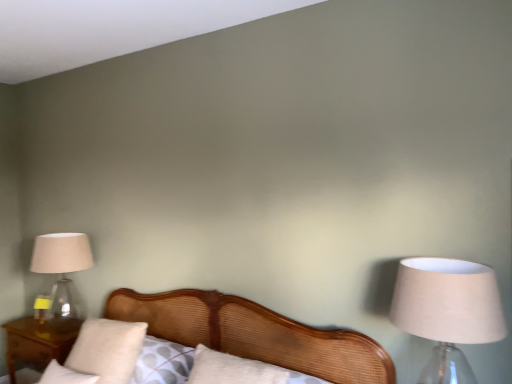
Question: From the image's perspective, is wooden bed at center above or below beige fabric lampshade at right, positioned as the second lamp in left-to-right order?

Choices:
 (A) above
 (B) below

Answer: (B)

Question: Considering the positions of wooden bed at center and beige fabric lampshade at right, positioned as the second lamp in left-to-right order, in the image, is wooden bed at center taller or shorter than beige fabric lampshade at right, positioned as the second lamp in left-to-right order,?

Choices:
 (A) short
 (B) tall

Answer: (B)

Question: Which is farther from the beige fabric lampshade at right, positioned as the second lamp in left-to-right order?

Choices:
 (A) wooden bed at center
 (B) clear glass lampshade at left, positioned as the first lamp in left-to-right order
 (C) wooden nightstand at lower left
 (D) white soft pillow at lower left, marked as the first pillow in a bottom-to-top arrangement
 (E) white soft pillow at lower left, which is the second pillow in bottom-to-top order

Answer: (C)

Question: Which object is the closest to the beige fabric lampshade at right, acting as the 1th lamp starting from the right?

Choices:
 (A) white soft pillow at lower left, marked as the first pillow in a bottom-to-top arrangement
 (B) white soft pillow at lower left, the first pillow positioned from the top
 (C) wooden bed at center
 (D) clear glass lampshade at left, the first lamp from the back
 (E) wooden nightstand at lower left

Answer: (C)